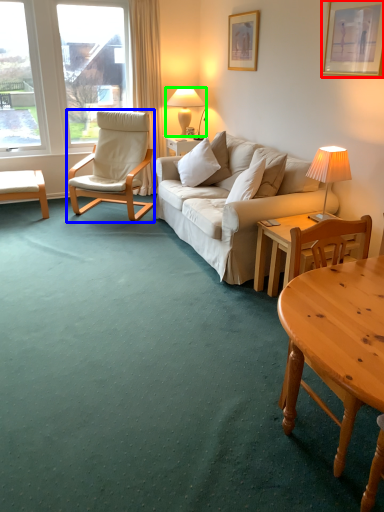
Question: Which object is positioned closest to picture frame (highlighted by a red box)? Select from chair (highlighted by a blue box) and lamp (highlighted by a green box).

Choices:
 (A) chair
 (B) lamp

Answer: (B)